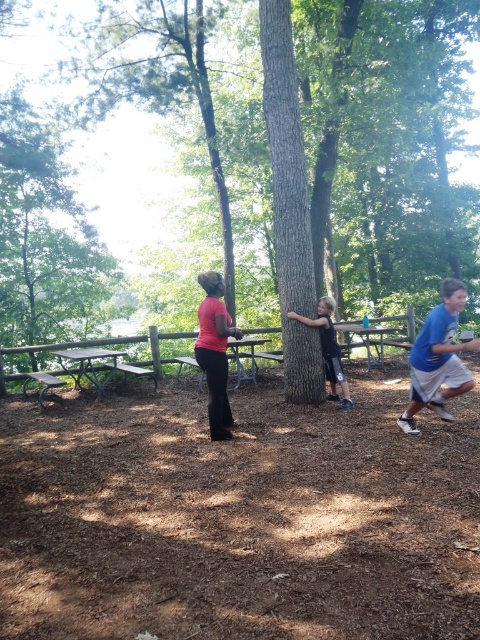
Question: Is green rough bark tree at center to the left of black matte shirt at center from the viewer's perspective?

Choices:
 (A) yes
 (B) no

Answer: (B)

Question: Can you confirm if blue cotton shirt at right is smaller than wooden picnic table at center?

Choices:
 (A) yes
 (B) no

Answer: (A)

Question: Which point is closer to the camera taking this photo?

Choices:
 (A) click(x=36, y=132)
 (B) click(x=361, y=342)
 (C) click(x=84, y=364)
 (D) click(x=115, y=166)

Answer: (C)

Question: Which object is positioned closest to the metallic silver picnic table at lower left?

Choices:
 (A) matte pink shirt at center
 (B) green leafy tree at upper left

Answer: (A)

Question: Among these points, which one is nearest to the camera?

Choices:
 (A) (371, 336)
 (B) (86, 355)

Answer: (B)

Question: Can you confirm if green rough bark tree at center is positioned to the left of blue cotton shirt at right?

Choices:
 (A) yes
 (B) no

Answer: (A)